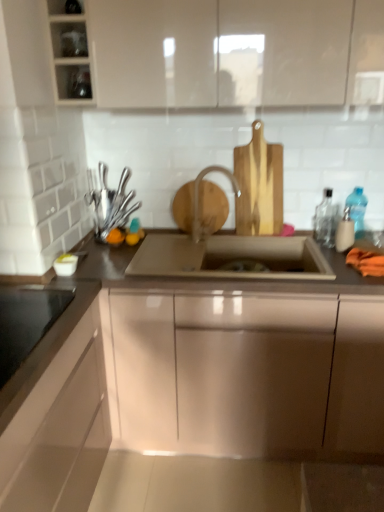
Question: Is satin nickel sink at center positioned in front of satin nickel faucet at center?

Choices:
 (A) no
 (B) yes

Answer: (B)

Question: Would you consider satin nickel sink at center to be distant from satin nickel faucet at center?

Choices:
 (A) no
 (B) yes

Answer: (A)

Question: Is satin nickel sink at center in contact with satin nickel faucet at center?

Choices:
 (A) no
 (B) yes

Answer: (A)

Question: From the image's perspective, would you say satin nickel sink at center is positioned over satin nickel faucet at center?

Choices:
 (A) no
 (B) yes

Answer: (A)

Question: Is satin nickel sink at center taller than satin nickel faucet at center?

Choices:
 (A) yes
 (B) no

Answer: (B)

Question: Considering the relative sizes of satin nickel sink at center and satin nickel faucet at center in the image provided, is satin nickel sink at center smaller than satin nickel faucet at center?

Choices:
 (A) no
 (B) yes

Answer: (A)

Question: Can you confirm if black glass cooktop at lower left, the first appliance in the front-to-back sequence, is thinner than transparent glass jars at upper left, which is the first shelf from bottom to top?

Choices:
 (A) yes
 (B) no

Answer: (A)

Question: Is black glass cooktop at lower left, arranged as the 1th appliance when ordered from the bottom, wider than transparent glass jars at upper left, which is the first shelf from bottom to top?

Choices:
 (A) yes
 (B) no

Answer: (B)

Question: Is the depth of black glass cooktop at lower left, marked as the second appliance in a back-to-front arrangement, less than that of transparent glass jars at upper left, positioned as the second shelf in top-to-bottom order?

Choices:
 (A) yes
 (B) no

Answer: (A)

Question: Does black glass cooktop at lower left, marked as the second appliance in a back-to-front arrangement, have a lesser height compared to transparent glass jars at upper left, which is the first shelf from bottom to top?

Choices:
 (A) yes
 (B) no

Answer: (A)

Question: Is black glass cooktop at lower left, arranged as the 1th appliance when ordered from the bottom, to the right of transparent glass jars at upper left, which is the first shelf from bottom to top, from the viewer's perspective?

Choices:
 (A) no
 (B) yes

Answer: (A)

Question: Is black glass cooktop at lower left, which appears as the second appliance when viewed from the top, aimed at transparent glass jars at upper left, positioned as the second shelf in top-to-bottom order?

Choices:
 (A) yes
 (B) no

Answer: (B)

Question: Can you confirm if glossy metallic sink at center, which is counted as the second cabinetry, starting from the top, is shorter than satin nickel faucet at center?

Choices:
 (A) yes
 (B) no

Answer: (B)